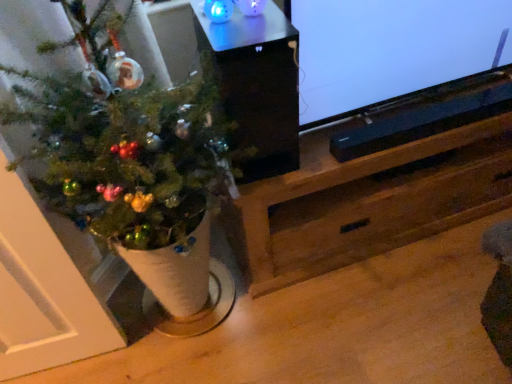
At what (x,y) coordinates should I click in order to perform the action: click on free space above black glossy speaker at upper center (from a real-world perspective). Please return your answer as a coordinate pair (x, y). The image size is (512, 384). Looking at the image, I should click on (247, 26).